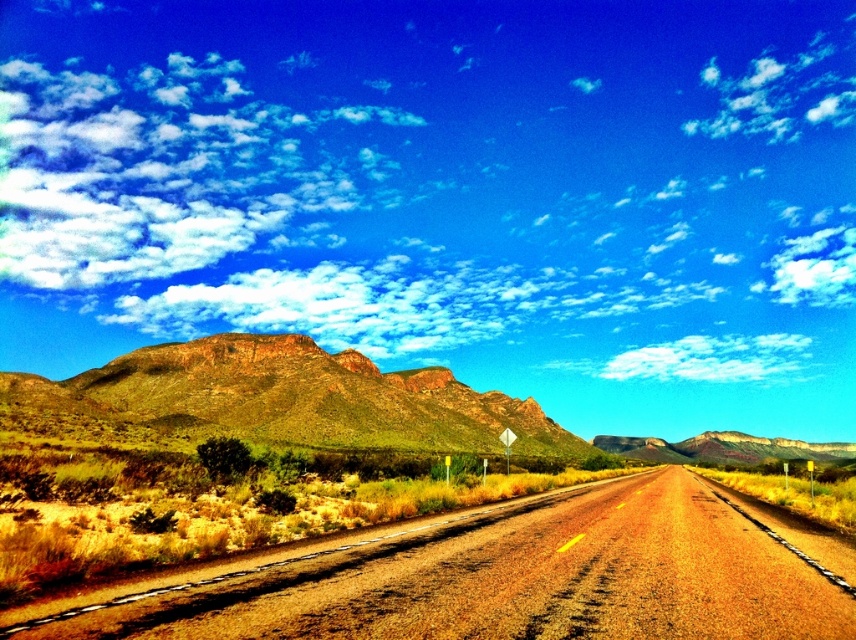
Which is behind, point (345, 566) or point (331, 358)?

The point (331, 358) is behind.

Find the location of `dried grass at center`. dried grass at center is located at coordinates (503, 577).

The width and height of the screenshot is (856, 640). Identify the location of dried grass at center. (503, 577).